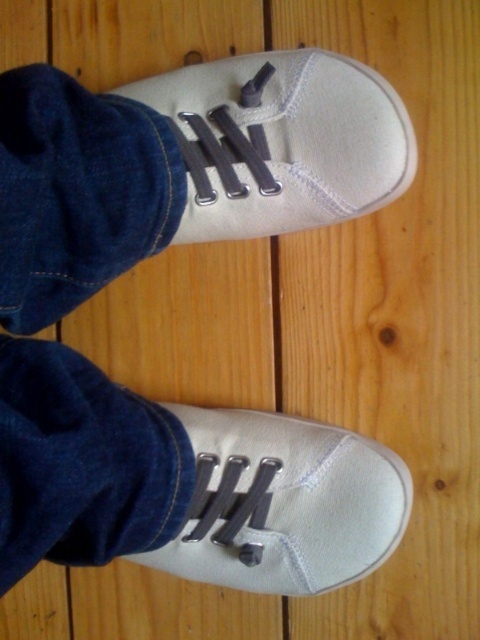
Based on the photo, does white canvas shoe at upper center have a larger size compared to white canvas shoe at lower center?

No.

Does white canvas shoe at upper center come in front of white canvas shoe at lower center?

Yes, white canvas shoe at upper center is in front of white canvas shoe at lower center.

In the scene shown: Who is more distant from viewer, (393,125) or (368,563)?

The point (368,563) is behind.

Locate an element on the screen. The width and height of the screenshot is (480, 640). white canvas shoe at upper center is located at coordinates (282, 141).